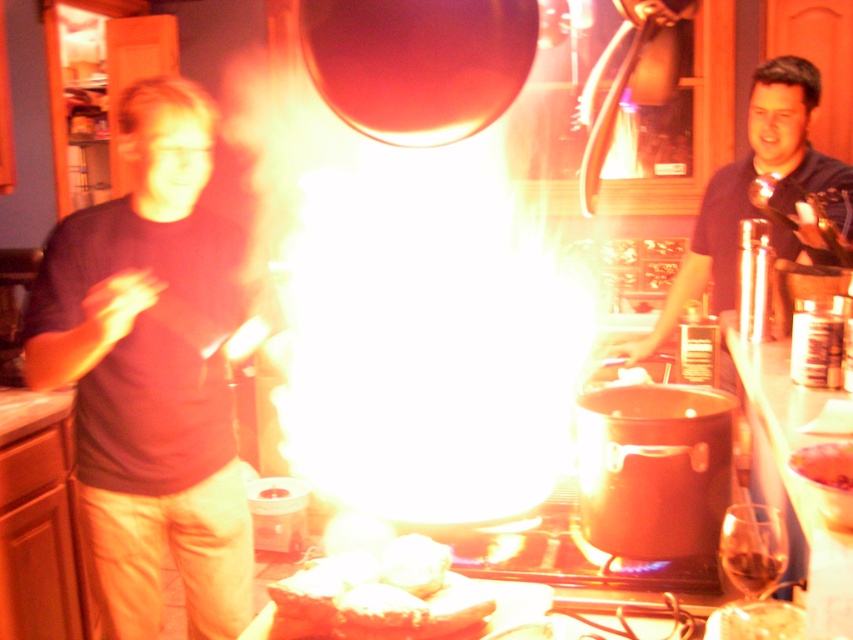
Question: Which point is closer to the camera?

Choices:
 (A) (802, 99)
 (B) (235, 324)

Answer: (B)

Question: Which of the following is the closest to the observer?

Choices:
 (A) black matte shirt at right
 (B) smooth pinkish-red cake at center
 (C) white vapor at center

Answer: (B)

Question: Does white vapor at center appear under white fluffy bread at center?

Choices:
 (A) no
 (B) yes

Answer: (A)

Question: Considering the relative positions of black matte shirt at right and white fluffy bread at center in the image provided, where is black matte shirt at right located with respect to white fluffy bread at center?

Choices:
 (A) below
 (B) above

Answer: (B)

Question: Which object is the closest to the matte black shirt at left?

Choices:
 (A) smooth pinkish-red cake at center
 (B) white fluffy bread at center
 (C) black matte shirt at right

Answer: (B)

Question: Does matte black shirt at left have a greater width compared to smooth pinkish-red cake at center?

Choices:
 (A) yes
 (B) no

Answer: (A)